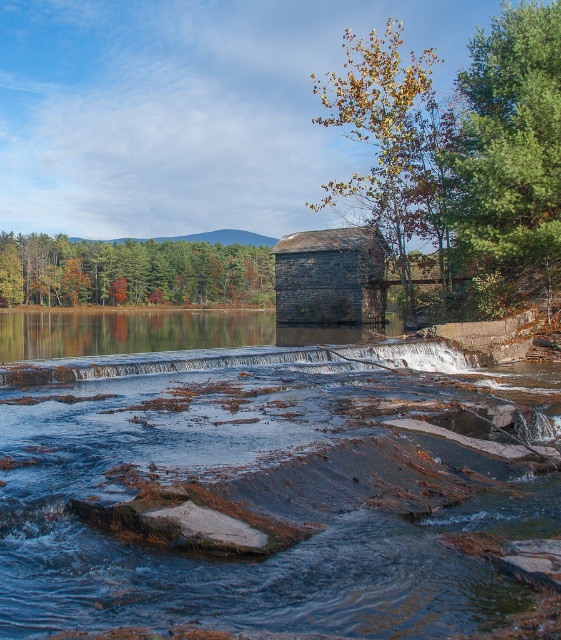
Question: From the image, what is the correct spatial relationship of yellow-green foliage at upper center in relation to smooth stone waterfall at center?

Choices:
 (A) below
 (B) above

Answer: (B)

Question: Does green textured pine tree at upper right appear under yellow-green foliage at upper center?

Choices:
 (A) yes
 (B) no

Answer: (B)

Question: Which point is farther to the camera?

Choices:
 (A) smooth stone waterfall at center
 (B) green matte tree at upper left

Answer: (B)

Question: Among these points, which one is nearest to the camera?

Choices:
 (A) (172, 371)
 (B) (25, 241)
 (C) (535, 99)
 (D) (393, 22)

Answer: (A)

Question: Can you confirm if green textured pine tree at upper right is positioned to the right of green matte tree at upper left?

Choices:
 (A) no
 (B) yes

Answer: (B)

Question: Which of the following is the farthest from the observer?

Choices:
 (A) green matte tree at upper left
 (B) smooth stone waterfall at center
 (C) green textured pine tree at upper right
 (D) yellow-green foliage at upper center

Answer: (A)